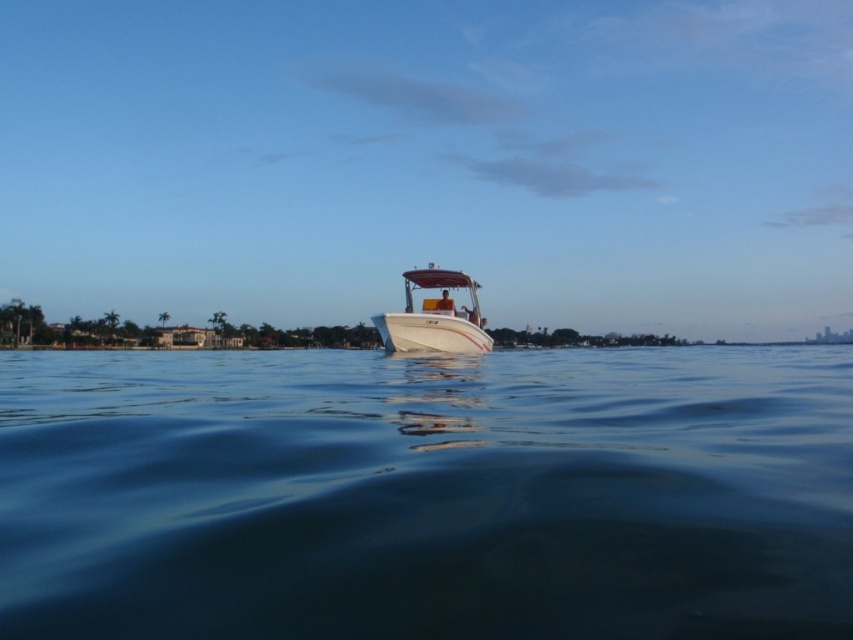
You are standing on the deck of a cruise ship that is 1.5 meters wide. You want to move from the deck to the small motorboat in the scene. Can you fit through the space between the clear blue water at center and the edge of the deck? Explain your reasoning.

The distance between the clear blue water at center and the viewer is 1.35 meters. Since the cruise ship deck is 1.5 meters wide, the space is narrower than the deck width. Therefore, the cruise ship cannot fit through the 1.35 meter gap as it is wider than the available space.

You are planning to take a photo of the clear blue water at center and the white glossy boat at center from the shore. Which object should you focus on first if you want to capture both in one frame without moving the camera?

The clear blue water at center is larger in size than the white glossy boat at center, so you should focus on the larger clear blue water at center first to ensure it fills the frame appropriately before adjusting for the boat.

You are a passenger on the white glossy boat at center. You want to see the clear blue water at center. Which direction should you look from your position on the boat?

You should look to your right to see the clear blue water at center, as it is located to the right of the white glossy boat at center.